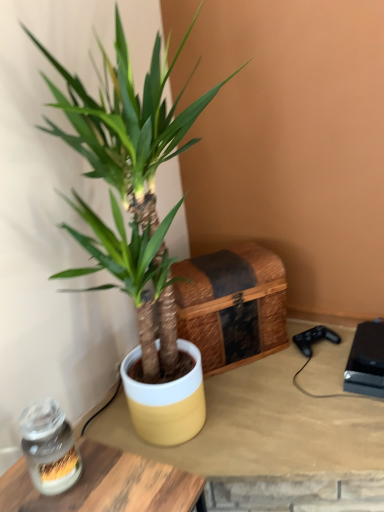
The height and width of the screenshot is (512, 384). What are the coordinates of `blank space situated above yellow matte pot at center, which is counted as the 2th table, starting from the front (from a real-world perspective)` in the screenshot? It's located at (271, 400).